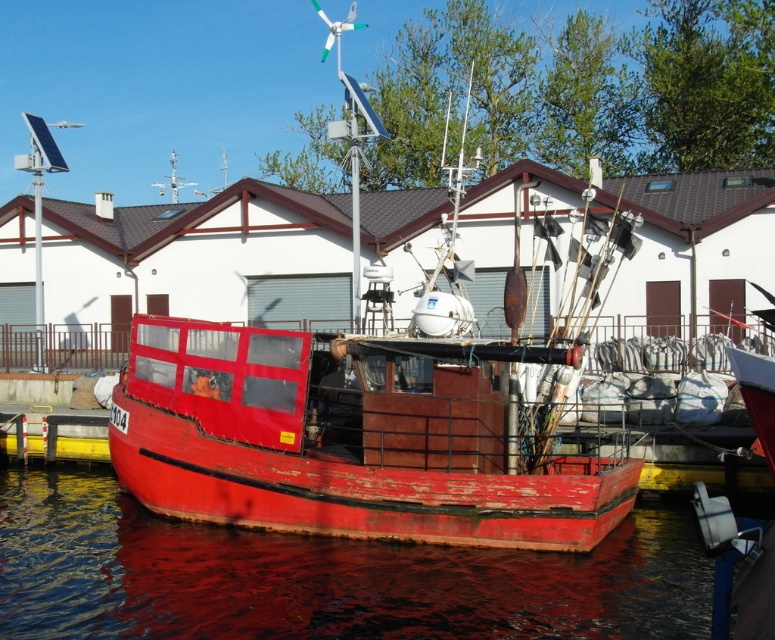
Is rusty metal boat at center taller than smooth red water at lower center?

Yes.

Can you confirm if rusty metal boat at center is smaller than smooth red water at lower center?

Indeed, rusty metal boat at center has a smaller size compared to smooth red water at lower center.

What do you see at coordinates (346, 438) in the screenshot? Image resolution: width=775 pixels, height=640 pixels. I see `rusty metal boat at center` at bounding box center [346, 438].

Identify the location of rusty metal boat at center. (346, 438).